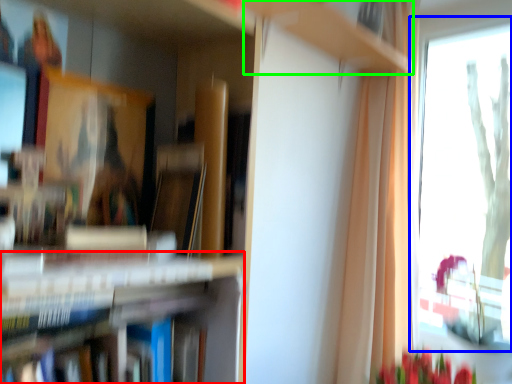
Question: Estimate the real-world distances between objects in this image. Which object is closer to bookshelf (highlighted by a red box), window (highlighted by a blue box) or cabinet (highlighted by a green box)?

Choices:
 (A) window
 (B) cabinet

Answer: (B)